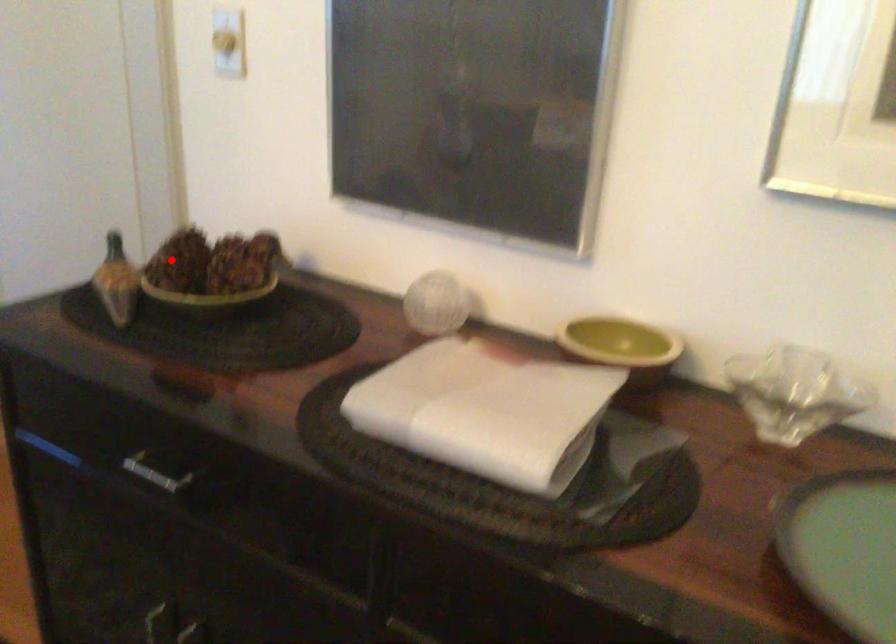
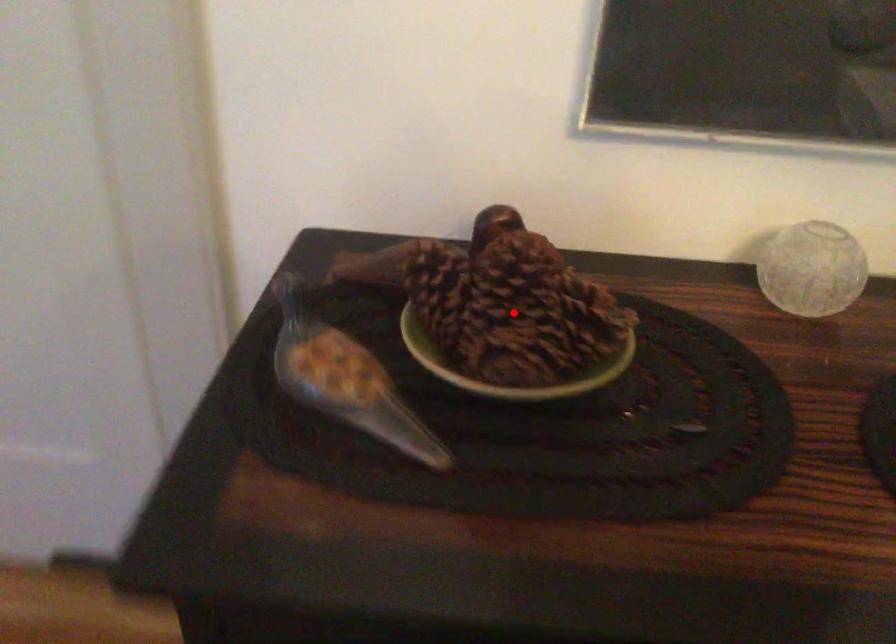
I am providing you with two images of the same scene from different viewpoints. A red point is marked on the first image and another point is marked on the second image. Does the point marked in image1 correspond to the same location as the one in image2?

No